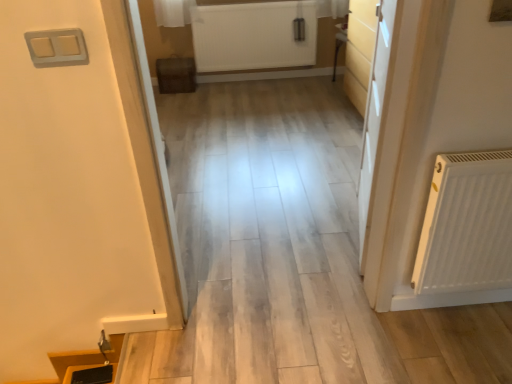
Question: Is white matte radiator at upper center bigger or smaller than light wood door at right?

Choices:
 (A) big
 (B) small

Answer: (B)

Question: Is point (249, 48) positioned closer to the camera than point (372, 178)?

Choices:
 (A) farther
 (B) closer

Answer: (A)

Question: In terms of width, does white matte radiator at upper center look wider or thinner when compared to light wood door at right?

Choices:
 (A) thin
 (B) wide

Answer: (A)

Question: Which is correct: light wood door at right is inside white matte radiator at upper center, or outside of it?

Choices:
 (A) outside
 (B) inside

Answer: (A)

Question: From a real-world perspective, relative to white matte radiator at upper center, is light wood door at right vertically above or below?

Choices:
 (A) above
 (B) below

Answer: (A)

Question: In terms of size, does light wood door at right appear bigger or smaller than white matte radiator at upper center?

Choices:
 (A) small
 (B) big

Answer: (B)

Question: Is light wood door at right taller or shorter than white matte radiator at upper center?

Choices:
 (A) tall
 (B) short

Answer: (A)